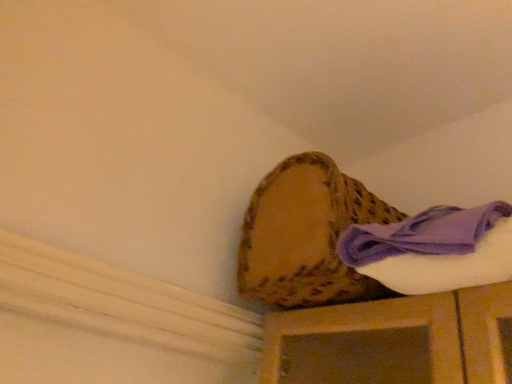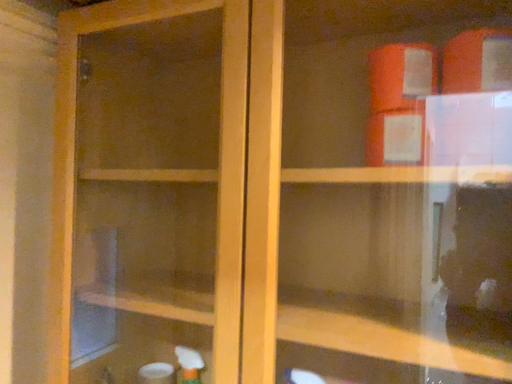
Question: Which way did the camera rotate in the video?

Choices:
 (A) rotated right
 (B) rotated left

Answer: (A)